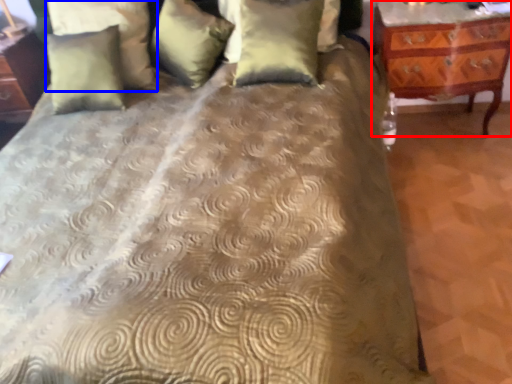
Question: Which object is further to the camera taking this photo, nightstand (highlighted by a red box) or pillow (highlighted by a blue box)?

Choices:
 (A) nightstand
 (B) pillow

Answer: (B)